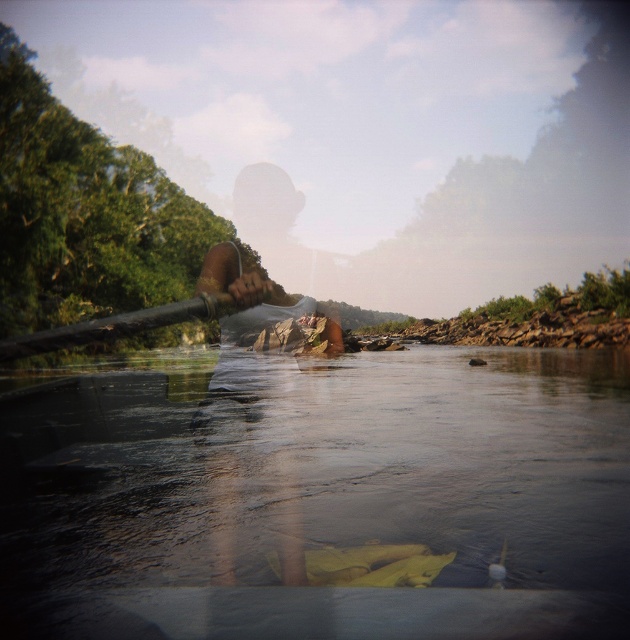
You are a photographer trying to capture the wooden paddle at center and the clear water at lower center in the same frame. Based on their positions, which object is closer to the camera?

The wooden paddle at center is closer to the camera than the clear water at lower center because the paddle is positioned at the center, while the water is further down at the lower center.

Consider the image. You are in a boat and want to avoid hitting the clear water at lower center. Based on your position, where should you steer your boat to stay away from it?

The clear water at lower center is located at point 0.777 on the x axis and 0.508 on the y axis. To avoid it, steer your boat away from those coordinates.

You are a photographer trying to capture the wooden paddle at center and the clear water at lower center in the same frame. Which object should you focus on first if you want to ensure both are in focus without adjusting your camera settings?

The wooden paddle at center should be focused on first since it is larger than the clear water at lower center, allowing for a greater depth of field to include both in focus.